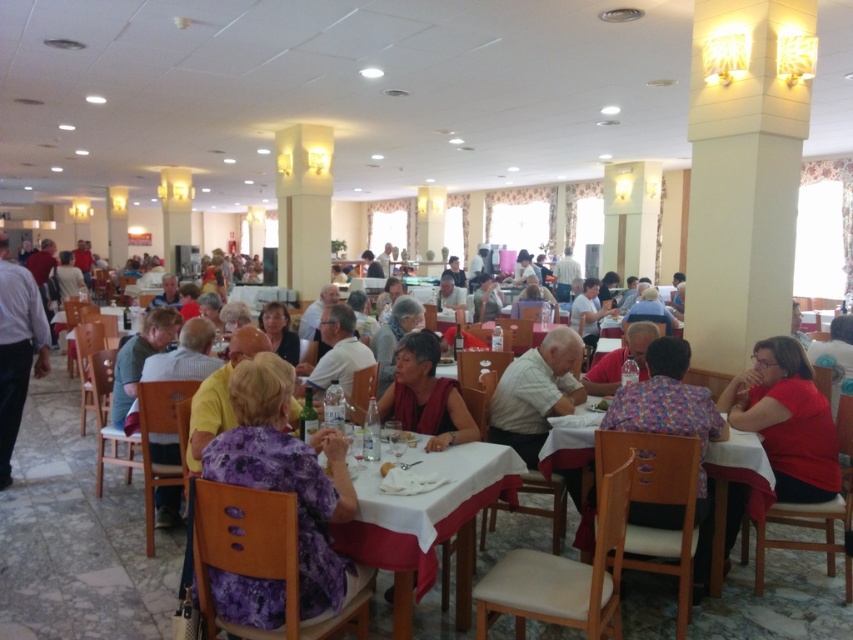
Does white cloth table at center have a lesser height compared to white wood table at center?

Incorrect, white cloth table at center's height does not fall short of white wood table at center's.

Is white cloth table at center closer to the viewer compared to white wood table at center?

Yes, white cloth table at center is closer to the viewer.

Which is behind, point (419, 540) or point (755, 504)?

Point (755, 504)

You are a GUI agent. You are given a task and a screenshot of the screen. Output one action in this format:
    pyautogui.click(x=<x>, y=<y>)
    Task: Click on the white cloth table at center
    The width and height of the screenshot is (853, 640).
    Given the screenshot: What is the action you would take?
    pyautogui.click(x=428, y=522)

Can you confirm if white wood table at center is wider than matte white shirt at center?

Yes, white wood table at center is wider than matte white shirt at center.

Does white wood table at center have a larger size compared to matte white shirt at center?

Incorrect, white wood table at center is not larger than matte white shirt at center.

Image resolution: width=853 pixels, height=640 pixels. Find the location of `white wood table at center`. white wood table at center is located at coordinates (741, 468).

Can you confirm if purple floral dress at center is bigger than floral fabric shirt at right?

No.

Image resolution: width=853 pixels, height=640 pixels. What do you see at coordinates (289, 477) in the screenshot?
I see `purple floral dress at center` at bounding box center [289, 477].

The width and height of the screenshot is (853, 640). Find the location of `purple floral dress at center`. purple floral dress at center is located at coordinates (289, 477).